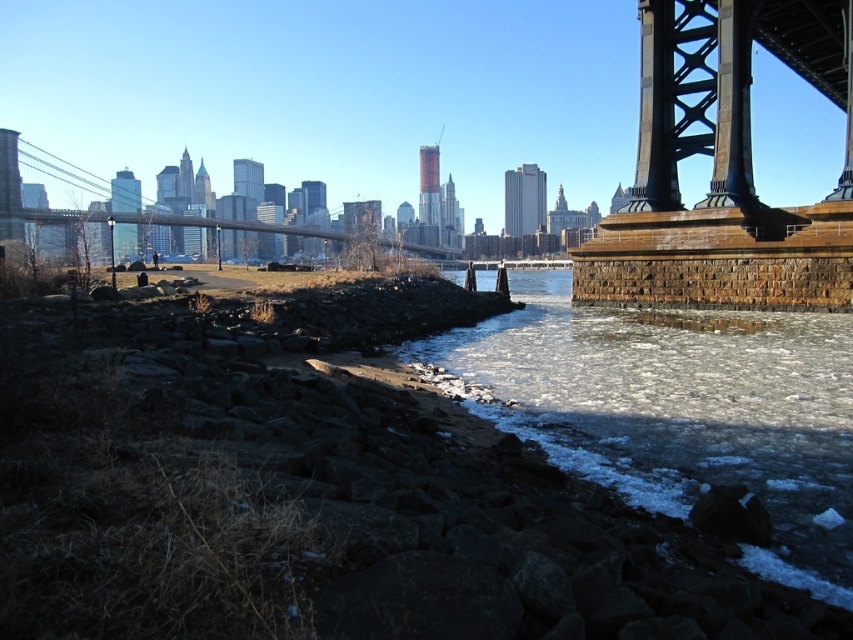
Question: Can you confirm if frozen ice at lower left is bigger than metallic gray suspension bridge at left?

Choices:
 (A) no
 (B) yes

Answer: (A)

Question: Does frozen ice at lower left appear on the right side of metallic gray suspension bridge at left?

Choices:
 (A) no
 (B) yes

Answer: (B)

Question: Where is frozen ice at lower left located in relation to metallic gray suspension bridge at left in the image?

Choices:
 (A) above
 (B) below

Answer: (B)

Question: Which point is farther to the camera?

Choices:
 (A) frozen ice at lower left
 (B) metallic gray suspension bridge at left

Answer: (B)